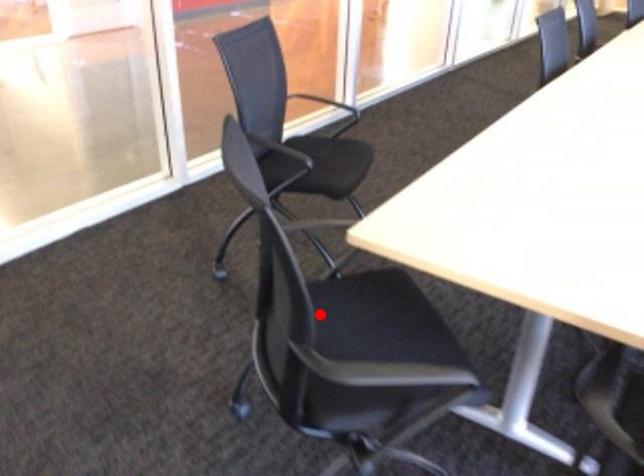
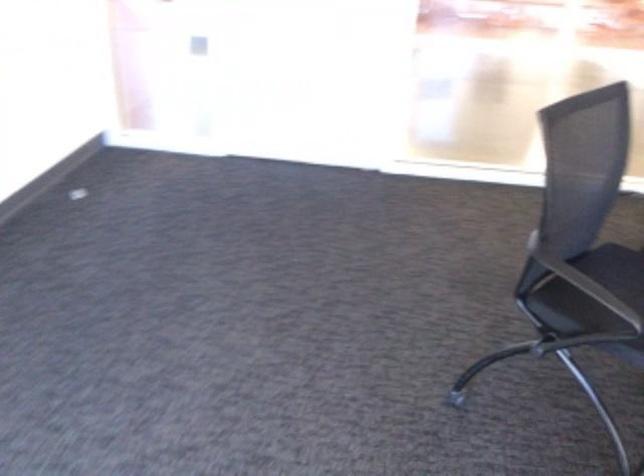
Locate, in the second image, the point that corresponds to the highlighted location in the first image.

(616, 269)